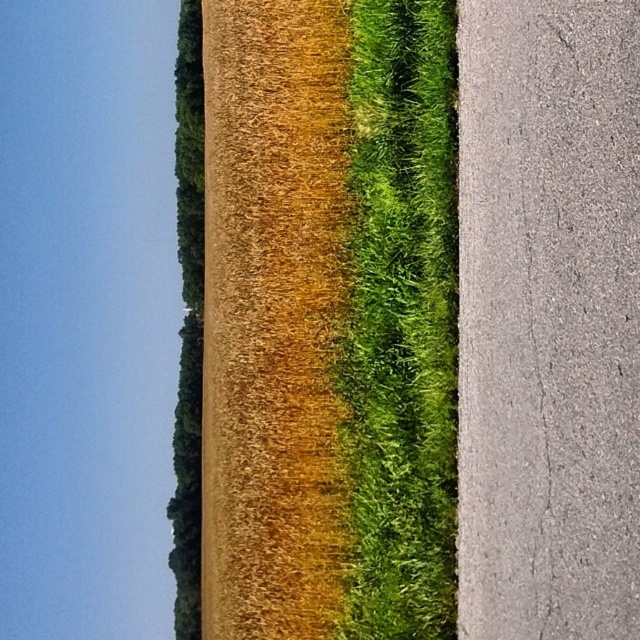
You are standing at the edge of the road and see the golden textured wheat at center and the green fuzzy grass at center. Which one is closer to your right side?

The green fuzzy grass at center is closer to your right side because the golden textured wheat at center is to the left of it.